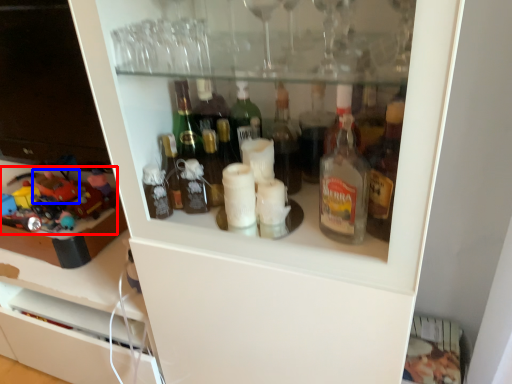
Question: Which of the following is the farthest to the observer, toy (highlighted by a red box) or toy (highlighted by a blue box)?

Choices:
 (A) toy
 (B) toy

Answer: (B)